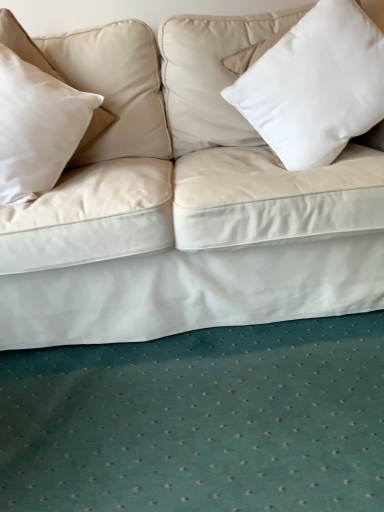
Question: Is white matte pillow at upper right, which is the 1th pillow in right-to-left order, not inside beige fabric pillow at left, the 1th pillow viewed from the left?

Choices:
 (A) yes
 (B) no

Answer: (A)

Question: Does white matte pillow at upper right, which is the 1th pillow in right-to-left order, appear on the right side of beige fabric pillow at left, the 2th pillow in the right-to-left sequence?

Choices:
 (A) yes
 (B) no

Answer: (A)

Question: Is white matte pillow at upper right, which is the 1th pillow in right-to-left order, facing towards beige fabric pillow at left, the 2th pillow in the right-to-left sequence?

Choices:
 (A) yes
 (B) no

Answer: (B)

Question: From the image's perspective, is white matte pillow at upper right, which is the 1th pillow in right-to-left order, located above beige fabric pillow at left, the 2th pillow in the right-to-left sequence?

Choices:
 (A) no
 (B) yes

Answer: (B)

Question: From a real-world perspective, does white matte pillow at upper right, which is the 1th pillow in right-to-left order, sit lower than beige fabric pillow at left, the 2th pillow in the right-to-left sequence?

Choices:
 (A) no
 (B) yes

Answer: (B)

Question: Does white matte pillow at upper right, which is the 1th pillow in right-to-left order, have a smaller size compared to beige fabric pillow at left, the 2th pillow in the right-to-left sequence?

Choices:
 (A) no
 (B) yes

Answer: (A)

Question: Is the depth of beige fabric pillow at left, the 1th pillow viewed from the left, greater than that of white matte pillow at upper right, the 2th pillow in the left-to-right sequence?

Choices:
 (A) no
 (B) yes

Answer: (A)

Question: Is there a large distance between beige fabric pillow at left, the 2th pillow in the right-to-left sequence, and white matte pillow at upper right, the 2th pillow in the left-to-right sequence?

Choices:
 (A) yes
 (B) no

Answer: (B)

Question: Can you confirm if beige fabric pillow at left, the 2th pillow in the right-to-left sequence, is taller than white matte pillow at upper right, the 2th pillow in the left-to-right sequence?

Choices:
 (A) yes
 (B) no

Answer: (B)

Question: Does beige fabric pillow at left, the 2th pillow in the right-to-left sequence, appear on the left side of white matte pillow at upper right, the 2th pillow in the left-to-right sequence?

Choices:
 (A) yes
 (B) no

Answer: (A)

Question: Can you confirm if beige fabric pillow at left, the 2th pillow in the right-to-left sequence, is positioned to the right of white matte pillow at upper right, the 2th pillow in the left-to-right sequence?

Choices:
 (A) no
 (B) yes

Answer: (A)

Question: Is beige fabric pillow at left, the 2th pillow in the right-to-left sequence, wider than white matte pillow at upper right, the 2th pillow in the left-to-right sequence?

Choices:
 (A) no
 (B) yes

Answer: (B)

Question: Choose the correct answer: Is beige fabric pillow at left, the 1th pillow viewed from the left, inside white matte pillow at upper right, the 2th pillow in the left-to-right sequence, or outside it?

Choices:
 (A) inside
 (B) outside

Answer: (B)